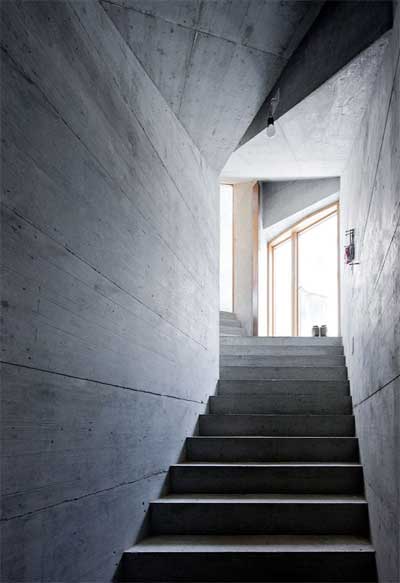
Find the location of a particular element. This screenshot has height=583, width=400. light on right wall is located at coordinates (349, 252).